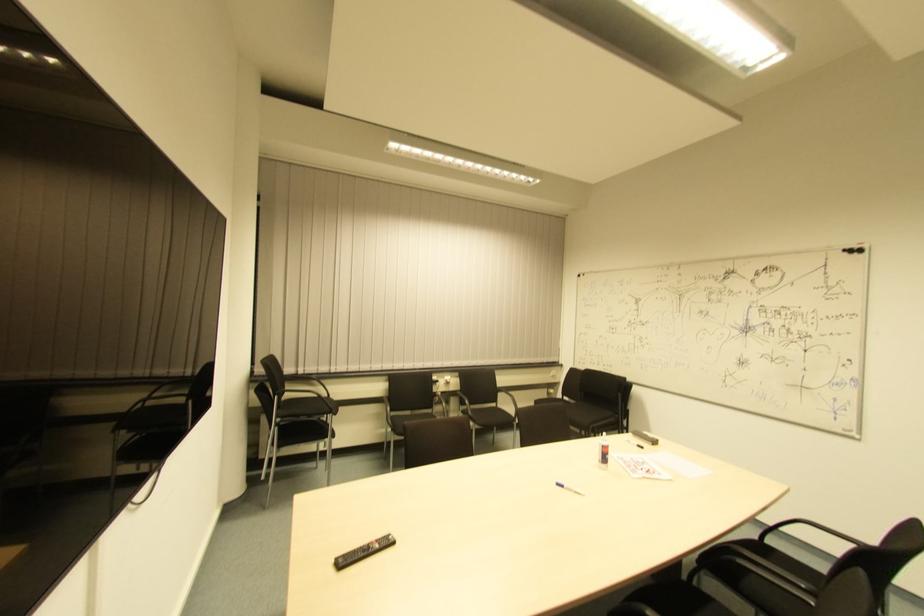
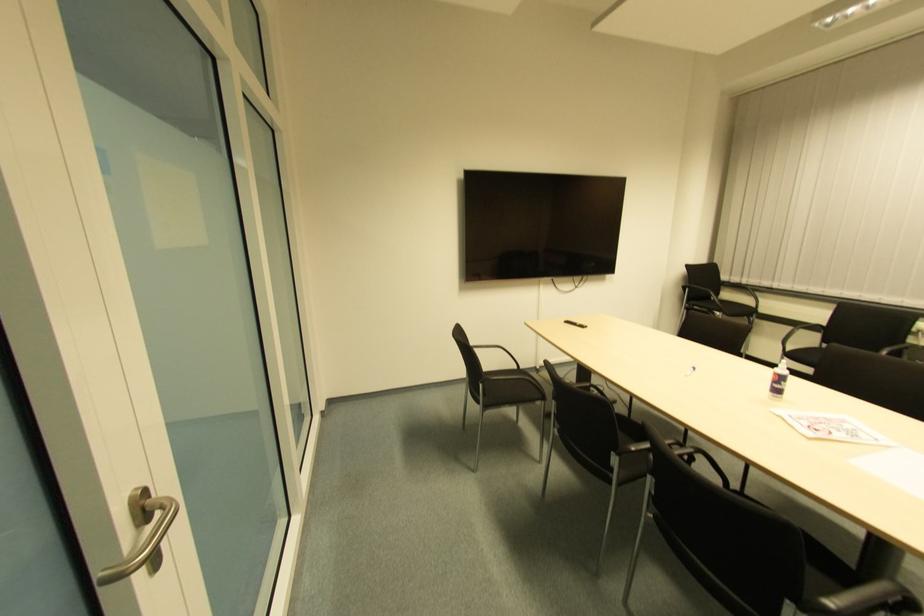
Find the pixel in the second image that matches the point at 275,419 in the first image.

(685, 306)